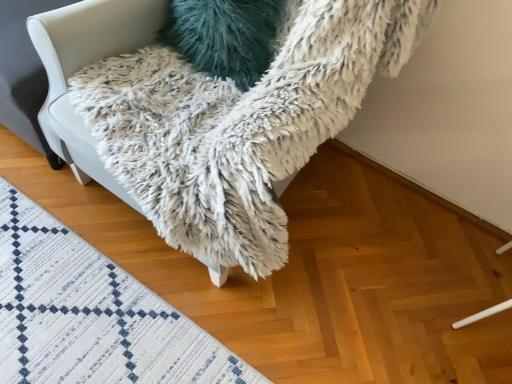
Question: From a real-world perspective, is white woven mat at lower left on teal fuzzy pillow at upper center?

Choices:
 (A) yes
 (B) no

Answer: (B)

Question: From a real-world perspective, is white woven mat at lower left below teal fuzzy pillow at upper center?

Choices:
 (A) yes
 (B) no

Answer: (A)

Question: Is white woven mat at lower left at the left side of teal fuzzy pillow at upper center?

Choices:
 (A) yes
 (B) no

Answer: (A)

Question: Can you confirm if white woven mat at lower left is smaller than teal fuzzy pillow at upper center?

Choices:
 (A) yes
 (B) no

Answer: (B)

Question: Is white woven mat at lower left aimed at teal fuzzy pillow at upper center?

Choices:
 (A) yes
 (B) no

Answer: (B)

Question: Is white fluffy blanket at upper center in front of or behind white woven mat at lower left in the image?

Choices:
 (A) behind
 (B) front

Answer: (B)

Question: Considering the positions of white fluffy blanket at upper center and white woven mat at lower left in the image, is white fluffy blanket at upper center taller or shorter than white woven mat at lower left?

Choices:
 (A) short
 (B) tall

Answer: (B)

Question: Considering the positions of white fluffy blanket at upper center and white woven mat at lower left in the image, is white fluffy blanket at upper center wider or thinner than white woven mat at lower left?

Choices:
 (A) thin
 (B) wide

Answer: (B)

Question: Which is correct: white fluffy blanket at upper center is inside white woven mat at lower left, or outside of it?

Choices:
 (A) inside
 (B) outside

Answer: (B)

Question: Would you say white fluffy blanket at upper center is inside or outside teal fuzzy pillow at upper center?

Choices:
 (A) inside
 (B) outside

Answer: (B)

Question: From their relative heights in the image, would you say white fluffy blanket at upper center is taller or shorter than teal fuzzy pillow at upper center?

Choices:
 (A) tall
 (B) short

Answer: (A)

Question: From the image's perspective, is white fluffy blanket at upper center located above or below teal fuzzy pillow at upper center?

Choices:
 (A) above
 (B) below

Answer: (B)

Question: In the image, is white fluffy blanket at upper center on the left side or the right side of teal fuzzy pillow at upper center?

Choices:
 (A) right
 (B) left

Answer: (A)

Question: In the image, is white woven mat at lower left positioned in front of or behind teal fuzzy pillow at upper center?

Choices:
 (A) behind
 (B) front

Answer: (B)

Question: Is white woven mat at lower left to the left or to the right of teal fuzzy pillow at upper center in the image?

Choices:
 (A) left
 (B) right

Answer: (A)